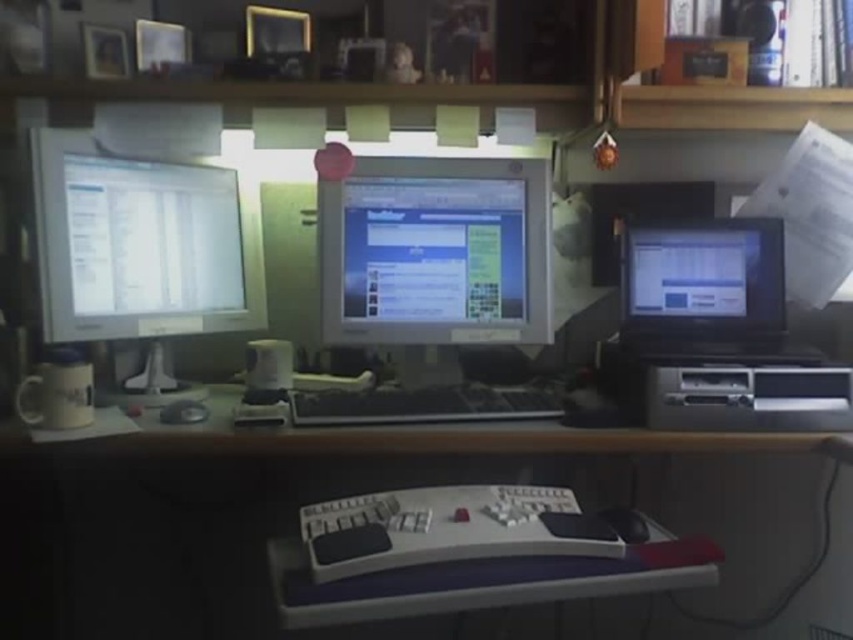
You are sitting at the desk and want to reach for an item. Which of the two points, point (386, 547) or point (839, 364), is closer to you?

Point (386, 547) is in front of point (839, 364), so it is closer to you.

You are organizing the desk and want to place a new item between the matte silver monitor at left and the black plastic keyboard at center. Is there enough space for it?

The matte silver monitor at left is to the left of the black plastic keyboard at center, so there is space between them to place the new item.

You are setting up a new desk setup and want to place the white plastic keyboard at center and the black rubber mouse at lower center. Considering their heights, which object will have a higher top surface?

The white plastic keyboard at center is taller than the black rubber mouse at lower center, so its top surface will be higher.